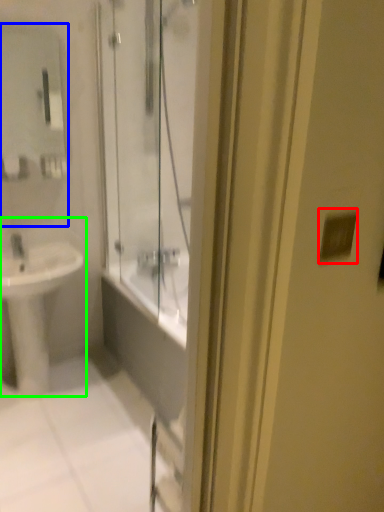
Question: Which is farther away from light switch (highlighted by a red box)? mirror (highlighted by a blue box) or sink (highlighted by a green box)?

Choices:
 (A) mirror
 (B) sink

Answer: (A)